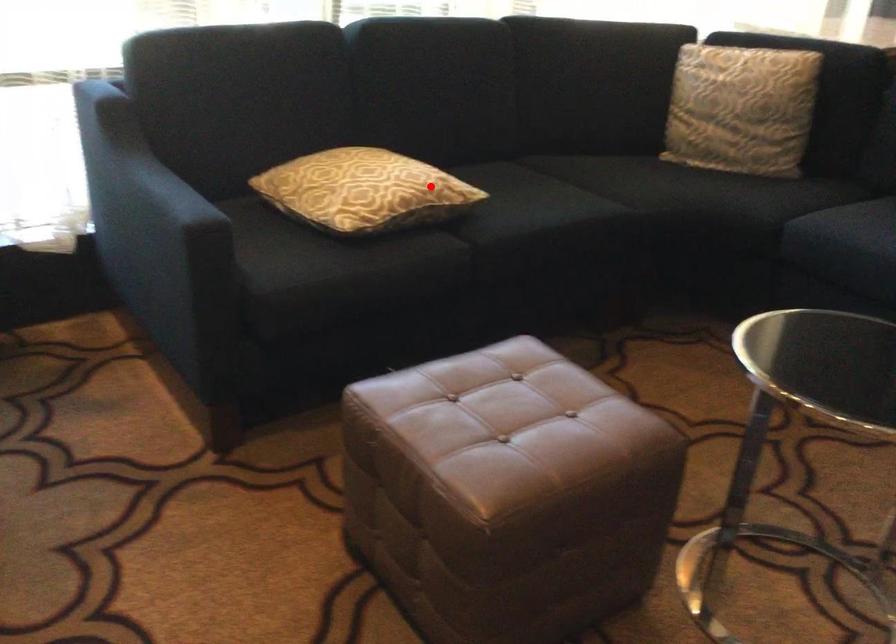
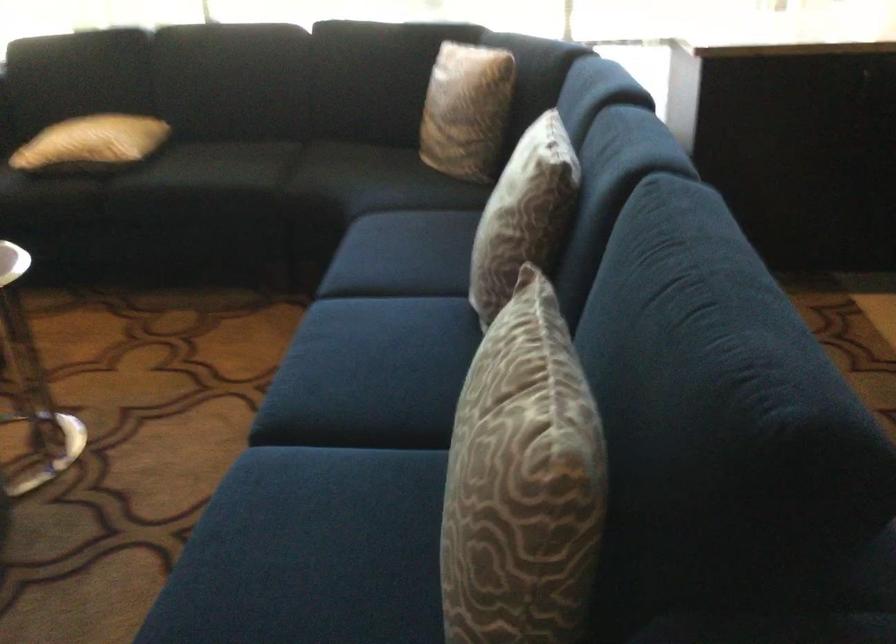
The point at the highlighted location is marked in the first image. Where is the corresponding point in the second image?

(91, 142)